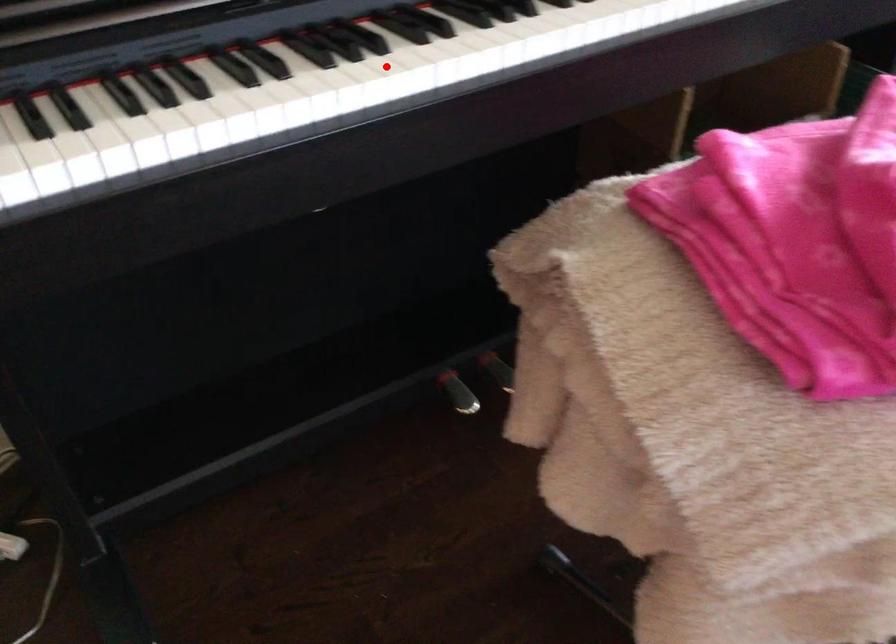
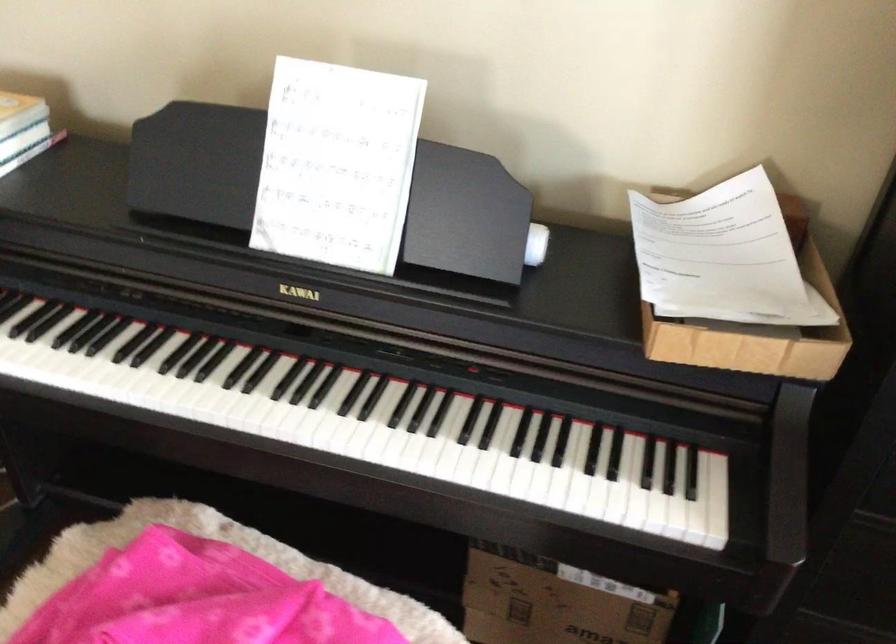
In the second image, find the point that corresponds to the highlighted location in the first image.

(58, 368)